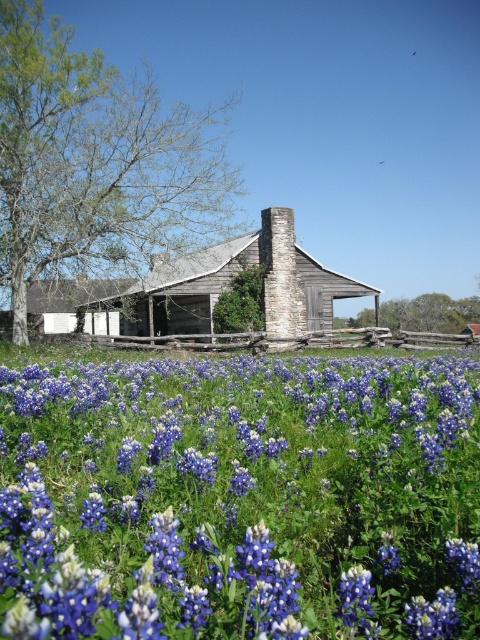
You are standing in the middle of the bluebonnet field looking towards the cabin. There are two points marked in the image. Which point, point (420, 492) or point (303, 268), is closer to you?

Point (420, 492) is closer to the viewer than point (303, 268).